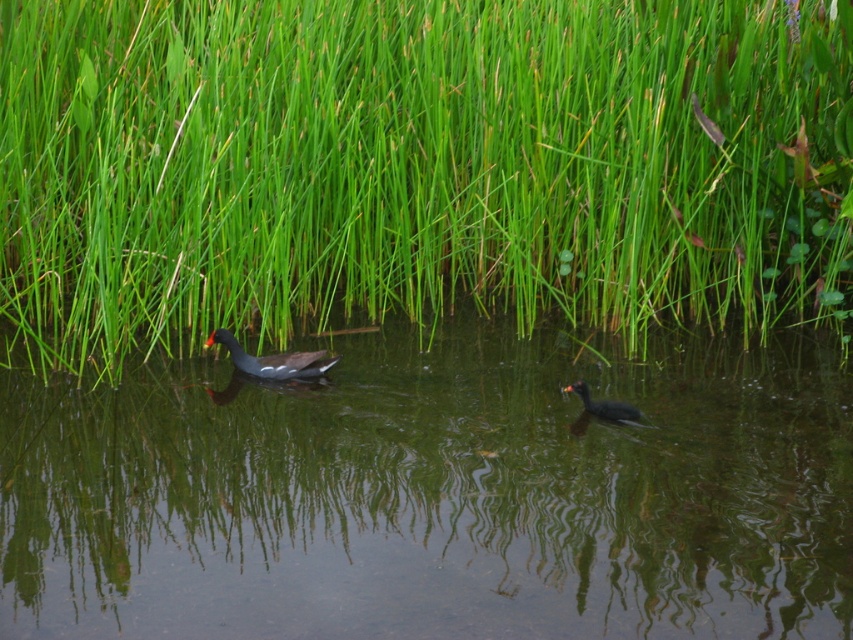
You are a small boat operator who needs to navigate between the green grass at center and the dark gray matte duck at lower right. The boat requires a minimum of 8 feet of space to pass safely. Based on the scene, can you safely navigate through the area between them?

The distance between the green grass at center and dark gray matte duck at lower right is 7.94 feet, which is slightly less than the required 8 feet. Therefore, navigating through the area may be risky and not safe for the boat.

You are a frog that needs to jump from the green grass at center to the clear water at center. Based on their sizes, which one is more likely to be a stable landing spot?

The green grass at center is larger in size than the clear water at center, so the green grass at center is more likely to be a stable landing spot for the frog.

Based on the photo, you are a photographer trying to capture the reflection of the green grass at center in the water. Since the dark gray matte duck at center is blocking the view, can you adjust your position to still see the reflection?

The green grass at center is located above the dark gray matte duck at center, so if you move your position to avoid the duck, you can still see the reflection of the green grass at center in the water.